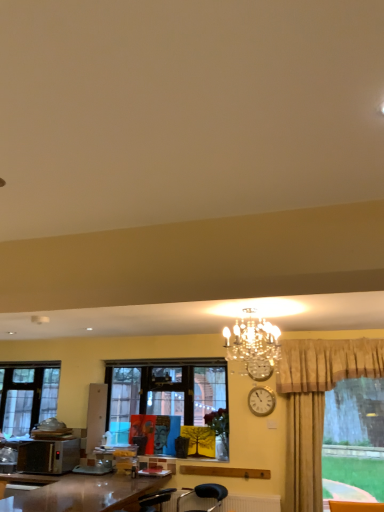
Question: Is matte wooden picture frame at center wider than silver metallic microwave oven at lower left?

Choices:
 (A) yes
 (B) no

Answer: (B)

Question: Is matte wooden picture frame at center outside silver metallic microwave oven at lower left?

Choices:
 (A) yes
 (B) no

Answer: (A)

Question: From the image's perspective, is matte wooden picture frame at center located above silver metallic microwave oven at lower left?

Choices:
 (A) no
 (B) yes

Answer: (B)

Question: Is matte wooden picture frame at center to the right of silver metallic microwave oven at lower left from the viewer's perspective?

Choices:
 (A) yes
 (B) no

Answer: (A)

Question: Is matte wooden picture frame at center to the left of silver metallic microwave oven at lower left from the viewer's perspective?

Choices:
 (A) no
 (B) yes

Answer: (A)

Question: Would you say matte wooden picture frame at center is to the left or to the right of shiny brown desk at lower left in the picture?

Choices:
 (A) right
 (B) left

Answer: (A)

Question: Is point pyautogui.click(x=145, y=434) positioned closer to the camera than point pyautogui.click(x=155, y=488)?

Choices:
 (A) farther
 (B) closer

Answer: (A)

Question: In the image, is matte wooden picture frame at center positioned in front of or behind shiny brown desk at lower left?

Choices:
 (A) behind
 (B) front

Answer: (A)

Question: In terms of size, does matte wooden picture frame at center appear bigger or smaller than shiny brown desk at lower left?

Choices:
 (A) big
 (B) small

Answer: (B)

Question: In the image, is silver metallic clock at upper center, placed as the 1th clock when sorted from bottom to top, positioned in front of or behind silver metallic microwave oven at lower left?

Choices:
 (A) behind
 (B) front

Answer: (B)

Question: Do you think silver metallic clock at upper center, which is the second clock in top-to-bottom order, is within silver metallic microwave oven at lower left, or outside of it?

Choices:
 (A) outside
 (B) inside

Answer: (A)

Question: In terms of height, does silver metallic clock at upper center, placed as the 1th clock when sorted from bottom to top, look taller or shorter compared to silver metallic microwave oven at lower left?

Choices:
 (A) short
 (B) tall

Answer: (A)

Question: In the image, is silver metallic clock at upper center, placed as the 1th clock when sorted from bottom to top, on the left side or the right side of silver metallic microwave oven at lower left?

Choices:
 (A) right
 (B) left

Answer: (A)

Question: From a real-world perspective, is silver metallic microwave oven at lower left positioned above or below shiny brown desk at lower left?

Choices:
 (A) below
 (B) above

Answer: (B)

Question: Is silver metallic microwave oven at lower left bigger or smaller than shiny brown desk at lower left?

Choices:
 (A) small
 (B) big

Answer: (A)